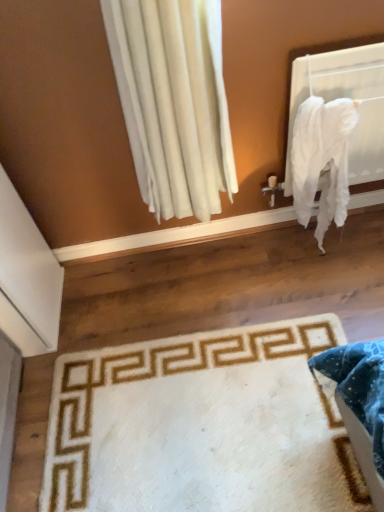
This screenshot has width=384, height=512. Find the location of `free point above white fabric at upper right (from a real-world perspective)`. free point above white fabric at upper right (from a real-world perspective) is located at coordinates (342, 45).